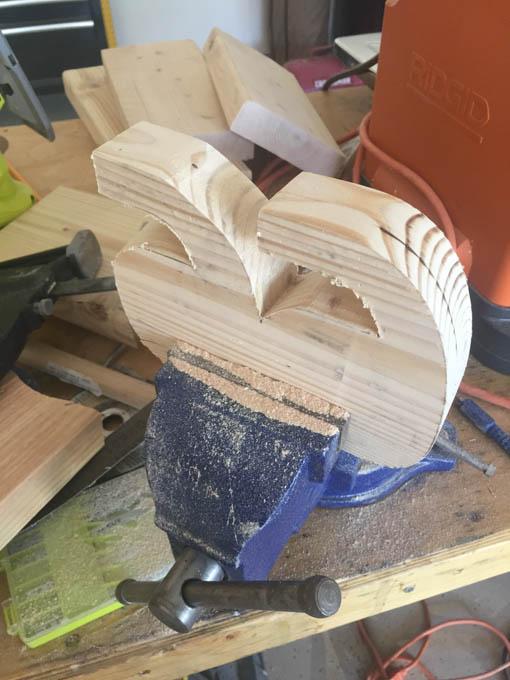
What are the coordinates of `handle` in the screenshot? It's located at pyautogui.click(x=235, y=605).